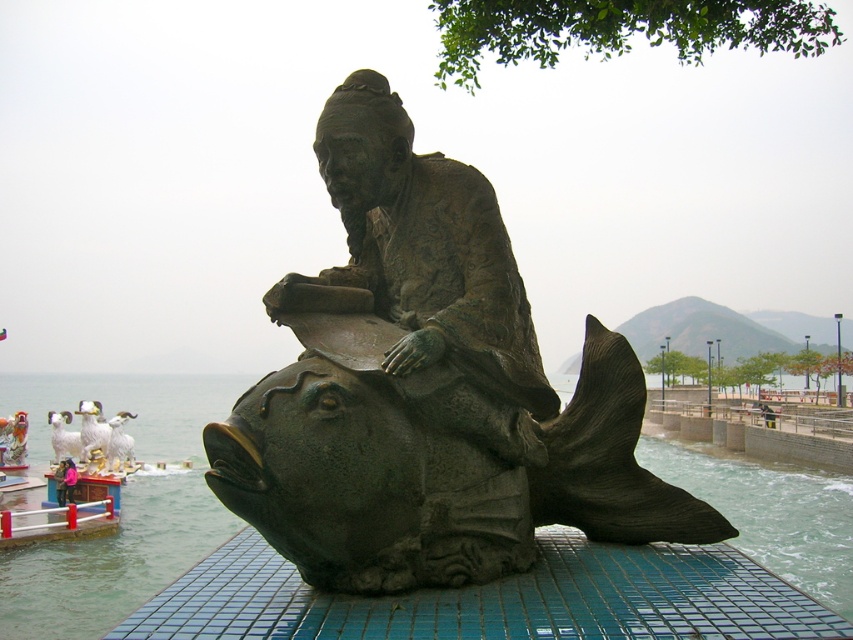
Is bronze statue at center wider than bronze fish sculpture at center?

No, bronze statue at center is not wider than bronze fish sculpture at center.

Which is more to the right, bronze statue at center or bronze fish sculpture at center?

bronze statue at center is more to the right.

Who is more forward, (325, 163) or (20, 600)?

Positioned in front is point (325, 163).

What are the coordinates of `bronze statue at center` in the screenshot? It's located at (430, 390).